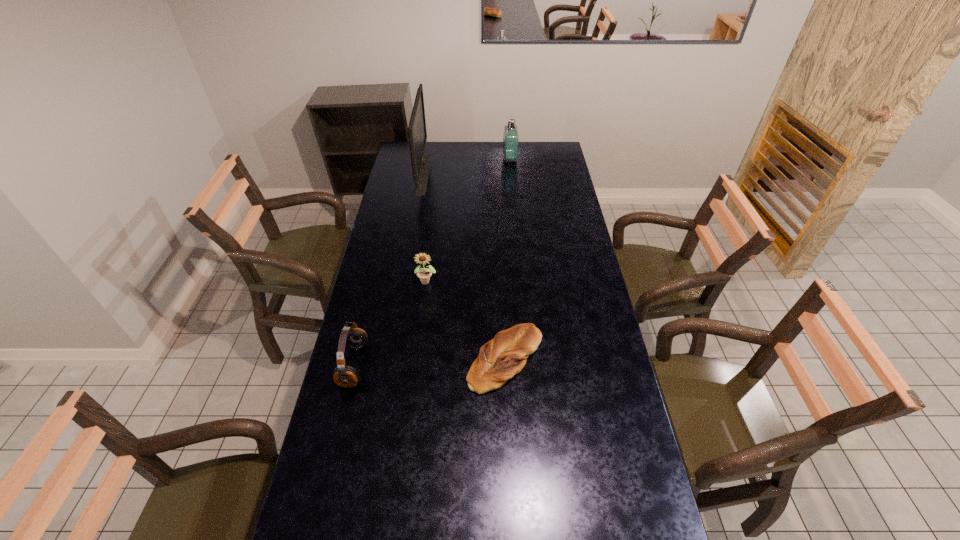
Locate an element on the screen. The height and width of the screenshot is (540, 960). free location located 0.180m on the front label of the second tallest object is located at coordinates (469, 159).

This screenshot has width=960, height=540. I want to click on vacant region located on the front-facing side of the third farthest object, so click(423, 312).

Locate an element on the screen. Image resolution: width=960 pixels, height=540 pixels. free space located on the ear cups of the headset is located at coordinates (460, 366).

The image size is (960, 540). Identify the location of free space located on the left of the shortest object. click(440, 360).

At what (x,y) coordinates should I click in order to perform the action: click on monitor at the far edge. Please return your answer as a coordinate pair (x, y). Looking at the image, I should click on (417, 134).

Where is `perfume situated at the far edge`? The image size is (960, 540). perfume situated at the far edge is located at coordinates (511, 133).

I want to click on monitor that is positioned at the left edge, so tap(417, 134).

You are a GUI agent. You are given a task and a screenshot of the screen. Output one action in this format:
    pyautogui.click(x=<x>, y=<y>)
    Task: Click on the headset present at the left edge
    
    Given the screenshot: What is the action you would take?
    coord(356,338)

Where is `object that is at the far left corner`? object that is at the far left corner is located at coordinates (417, 134).

This screenshot has width=960, height=540. I want to click on vacant space at the far edge of the desktop, so click(x=442, y=157).